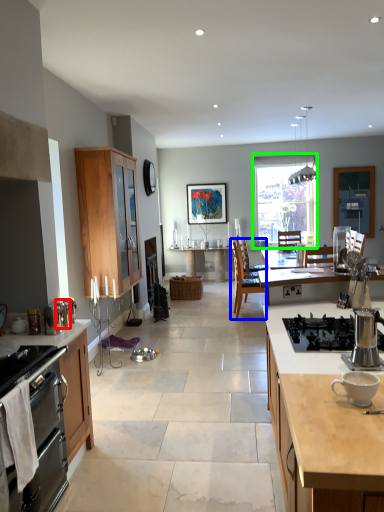
Question: Estimate the real-world distances between objects in this image. Which object is closer to appliance (highlighted by a red box), chair (highlighted by a blue box) or window (highlighted by a green box)?

Choices:
 (A) chair
 (B) window

Answer: (A)